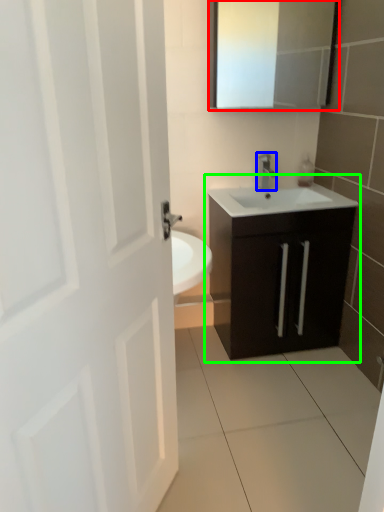
Question: Which object is the closest to the medicine cabinet (highlighted by a red box)? Choose among these: tap (highlighted by a blue box) or bathroom cabinet (highlighted by a green box).

Choices:
 (A) tap
 (B) bathroom cabinet

Answer: (A)